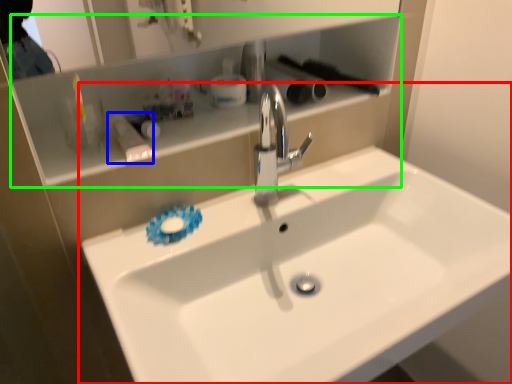
Question: Which object is the farthest from sink (highlighted by a red box)? Choose among these: toiletry (highlighted by a blue box) or cabinet (highlighted by a green box).

Choices:
 (A) toiletry
 (B) cabinet

Answer: (A)